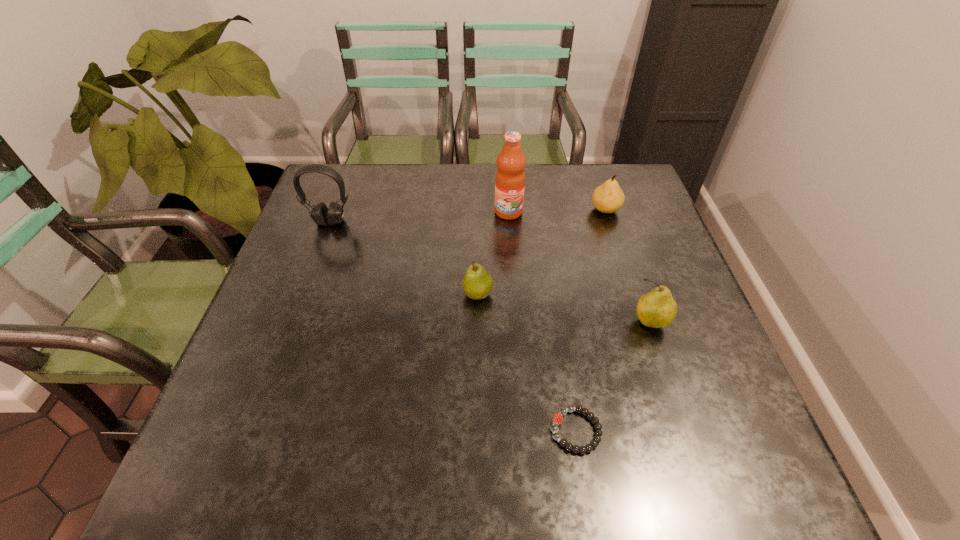
At what (x,y) coordinates should I click in order to perform the action: click on the tallest object. Please return your answer as a coordinate pair (x, y). This screenshot has height=540, width=960. Looking at the image, I should click on (510, 177).

Find the location of a particular element. This screenshot has height=540, width=960. fruit juice is located at coordinates (510, 177).

Locate an element on the screen. The image size is (960, 540). the leftmost object is located at coordinates (321, 215).

Identify the location of the fifth shortest object. This screenshot has width=960, height=540. (321, 215).

Identify the location of the farthest pear. [x=607, y=198].

Image resolution: width=960 pixels, height=540 pixels. I want to click on the nearest pear, so click(657, 309).

Image resolution: width=960 pixels, height=540 pixels. I want to click on the second object from left to right, so click(477, 284).

Locate an element on the screen. the fourth farthest object is located at coordinates (477, 284).

You are a GUI agent. You are given a task and a screenshot of the screen. Output one action in this format:
    pyautogui.click(x=<x>, y=<y>)
    Task: Click on the fourth object from left to right
    The height and width of the screenshot is (540, 960).
    Given the screenshot: What is the action you would take?
    pyautogui.click(x=558, y=418)

The width and height of the screenshot is (960, 540). In order to click on the shortest object in this screenshot , I will do `click(558, 418)`.